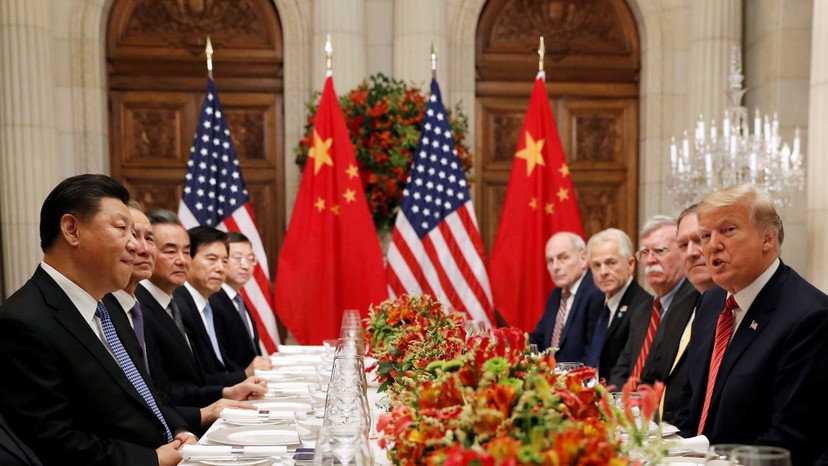
Identify the location of chandelier. (705, 170).